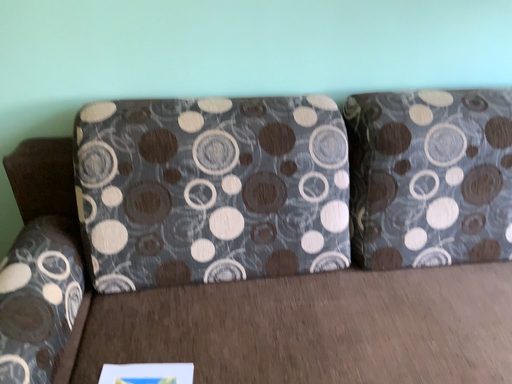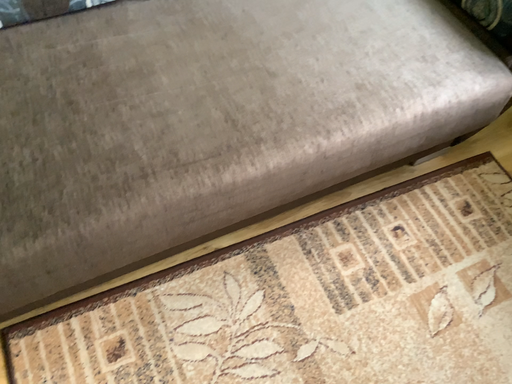
Question: How did the camera likely rotate when shooting the video?

Choices:
 (A) rotated left
 (B) rotated right

Answer: (B)